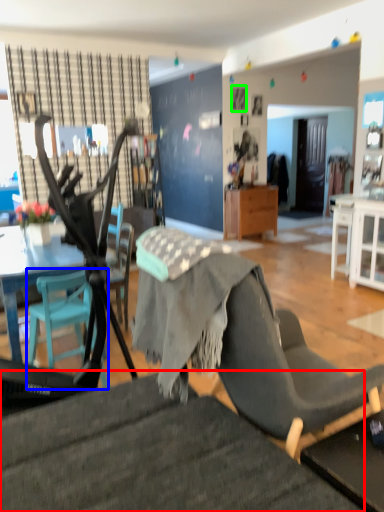
Question: Which object is positioned closest to chair (highlighted by a red box)? Select from chair (highlighted by a blue box) and picture frame (highlighted by a green box).

Choices:
 (A) chair
 (B) picture frame

Answer: (A)